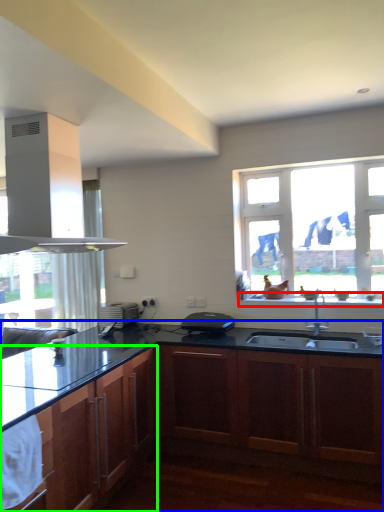
Question: Considering the real-world distances, which object is closest to window sill (highlighted by a red box)? cabinetry (highlighted by a blue box) or cabinetry (highlighted by a green box).

Choices:
 (A) cabinetry
 (B) cabinetry

Answer: (A)